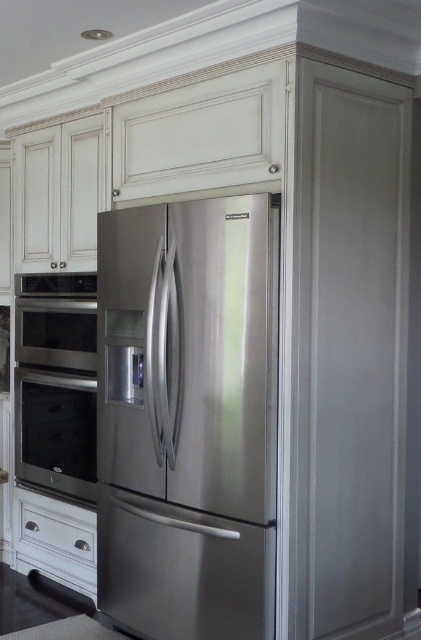
Is stainless steel oven at left below white wood drawer at lower left?

No.

Is stainless steel oven at left further to the viewer compared to white wood drawer at lower left?

No.

The width and height of the screenshot is (421, 640). I want to click on stainless steel oven at left, so click(55, 381).

I want to click on stainless steel oven at left, so click(x=55, y=381).

Identify the location of stainless steel refrigerator at center. The image size is (421, 640). (188, 417).

Consider the image. Can you confirm if stainless steel refrigerator at center is shorter than stainless steel oven at left?

Incorrect, stainless steel refrigerator at center's height does not fall short of stainless steel oven at left's.

Which is in front, point (116, 358) or point (55, 371)?

Point (116, 358) is in front.

The height and width of the screenshot is (640, 421). I want to click on stainless steel refrigerator at center, so click(x=188, y=417).

Between point (108, 525) and point (72, 515), which one is positioned in front?

Point (108, 525) is in front.

At what (x,y) coordinates should I click in order to perform the action: click on stainless steel refrigerator at center. Please return your answer as a coordinate pair (x, y). This screenshot has height=640, width=421. Looking at the image, I should click on (188, 417).